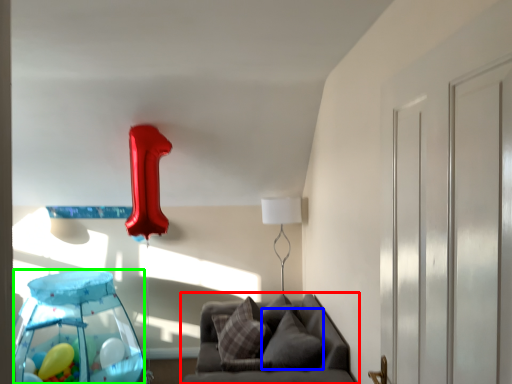
Question: Considering the real-world distances, which object is farthest from furniture (highlighted by a red box)? pillow (highlighted by a blue box) or glass table (highlighted by a green box)?

Choices:
 (A) pillow
 (B) glass table

Answer: (B)